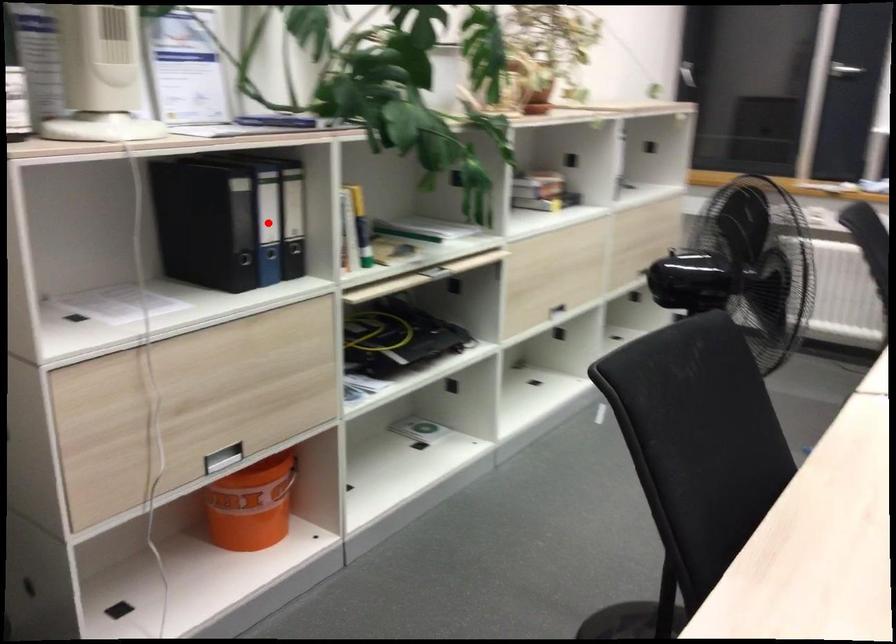
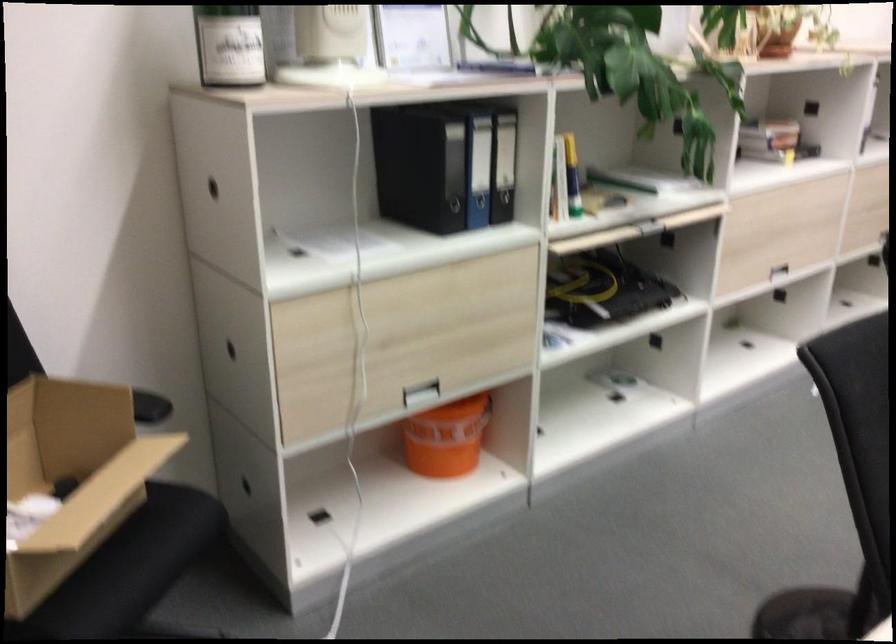
Locate, in the second image, the point that corresponds to the highlighted location in the first image.

(478, 169)